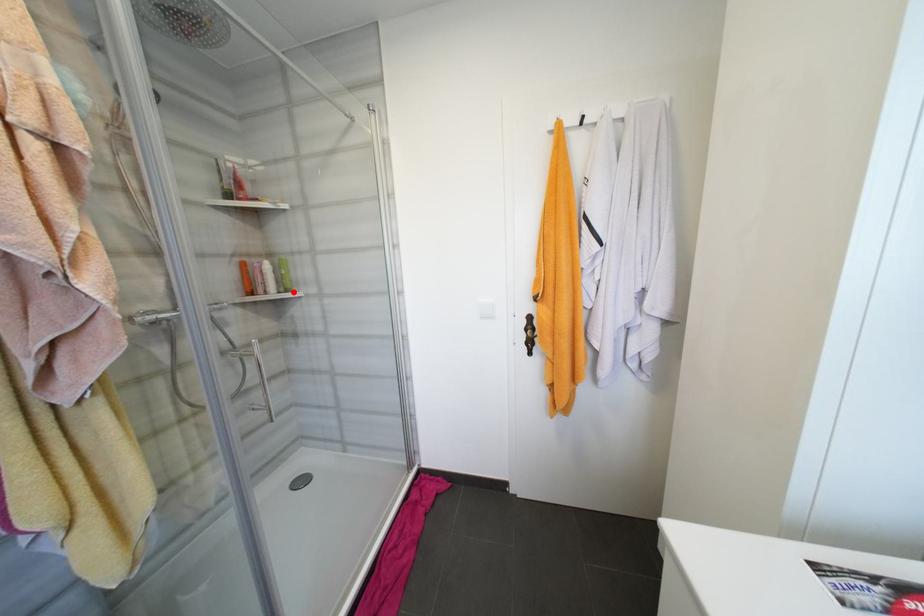
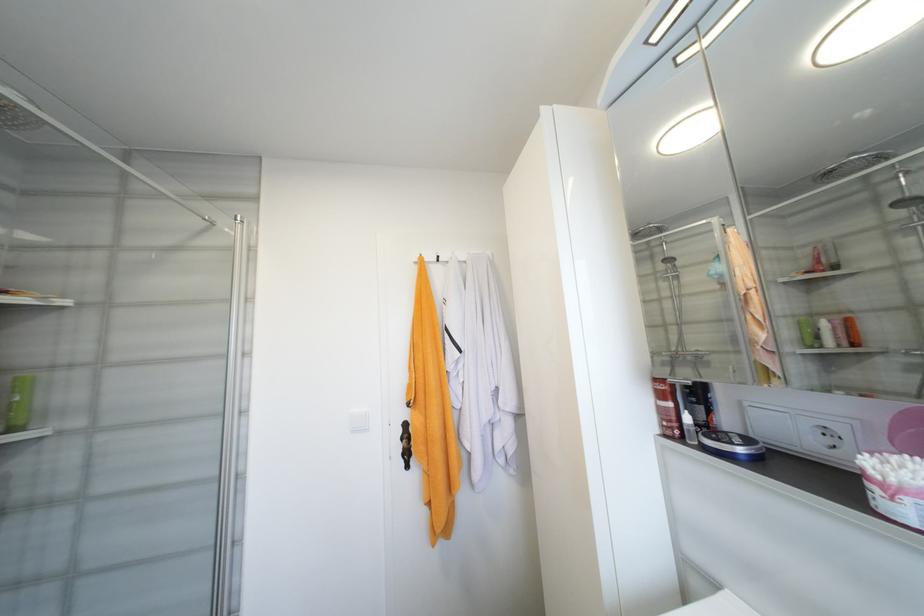
Locate, in the second image, the point that corresponds to the highlighted location in the first image.

(19, 430)